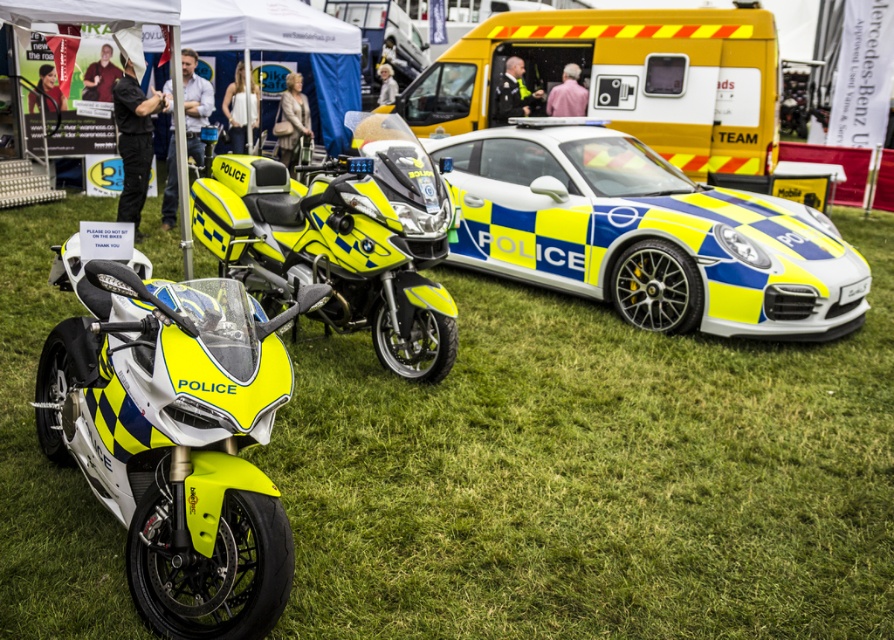
From the picture: You are a photographer trying to capture the entire scene of the police vehicles. You notice the green grass at center and the yellow matte police motorcycle at left. Which object takes up more space in the photo?

The yellow matte police motorcycle at left takes up more space in the photo because the green grass at center is smaller than it.

You are standing in front of the police vehicle display and want to take a photo that includes both the point at coordinates point (791, 621) and point (165, 432). Which point should you focus on first to ensure both are in focus?

You should focus on point (165, 432) first because it is closer to you than point (791, 621), which is further away. This way, the camera can adjust the focus to capture both points effectively.